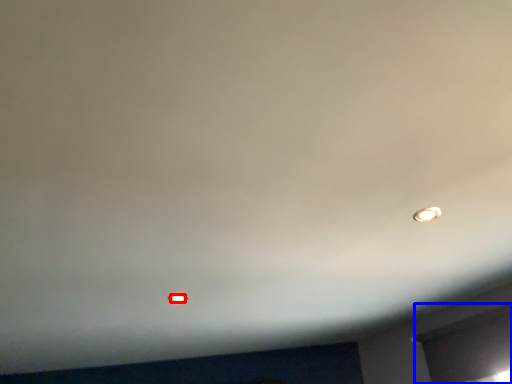
Question: Which point is further to the camera, light bulb (highlighted by a red box) or window (highlighted by a blue box)?

Choices:
 (A) light bulb
 (B) window

Answer: (A)